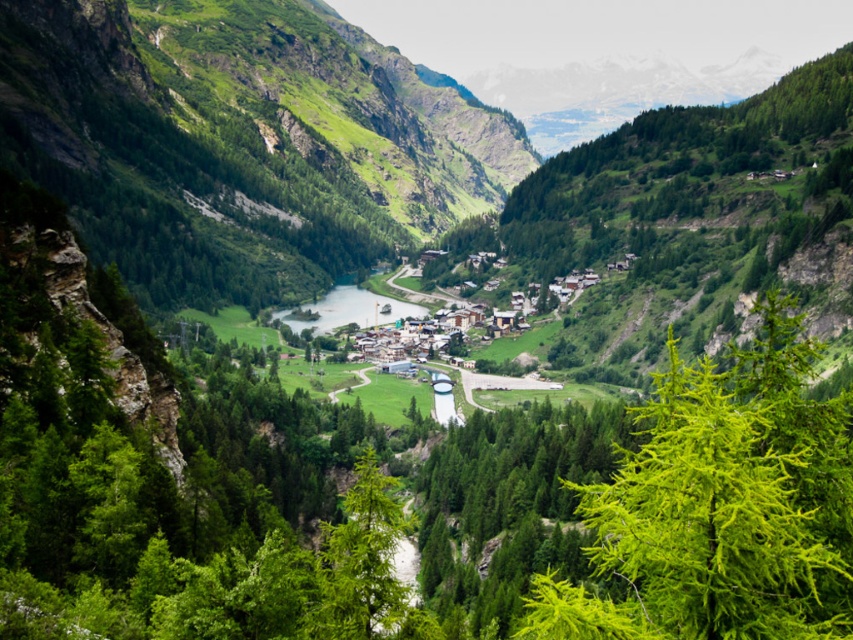
Based on the photo, can you confirm if green needle-like at center is smaller than green grassy river at center?

Actually, green needle-like at center might be larger than green grassy river at center.

Is green needle-like at center positioned in front of green grassy river at center?

Yes, it is in front of green grassy river at center.

Does point (692, 554) lie in front of point (367, 294)?

Yes, point (692, 554) is closer to viewer.

Image resolution: width=853 pixels, height=640 pixels. I want to click on green needle-like at center, so click(721, 506).